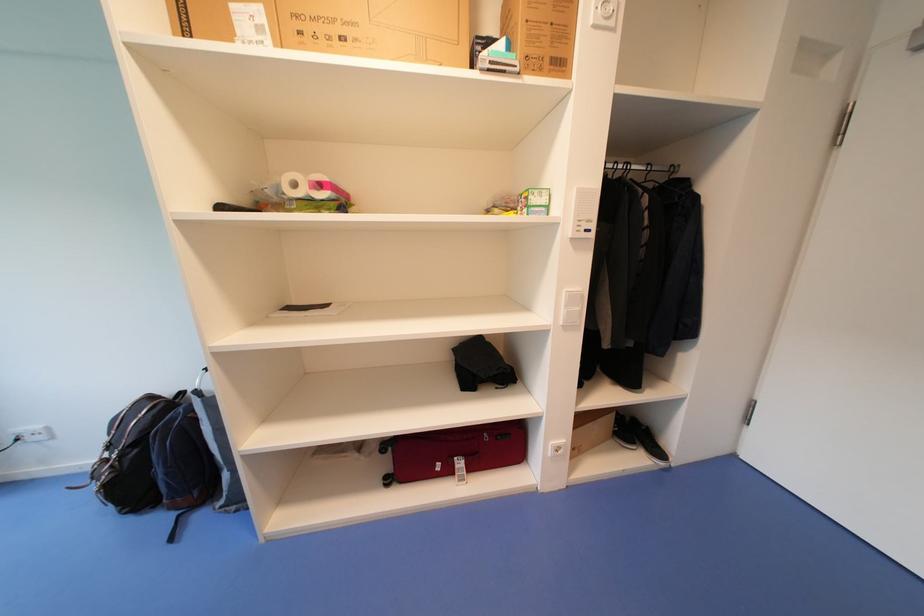
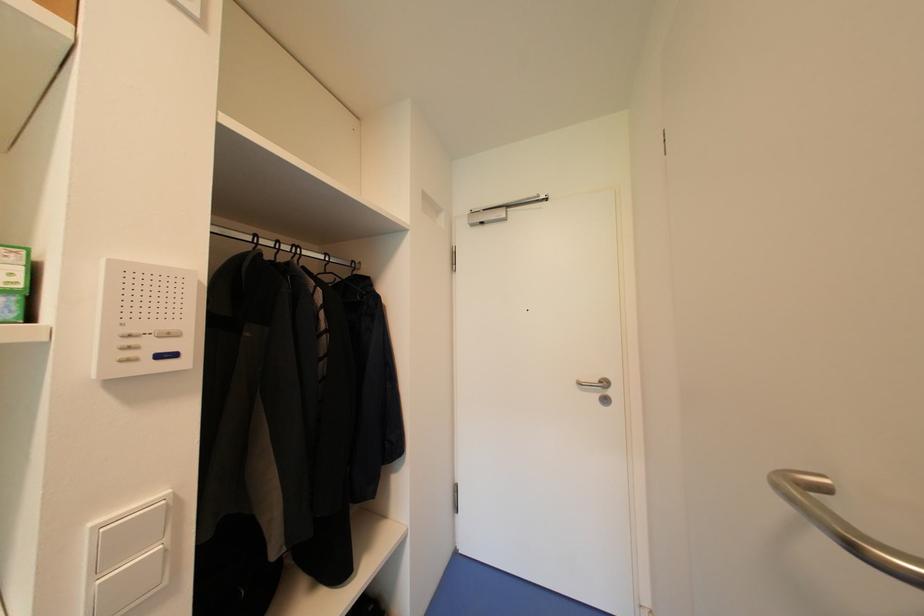
Question: Based on the continuous images, in which direction is the camera rotating? Reply with the corresponding letter.

Choices:
 (A) Left
 (B) Right
 (C) Up
 (D) Down

Answer: (B)